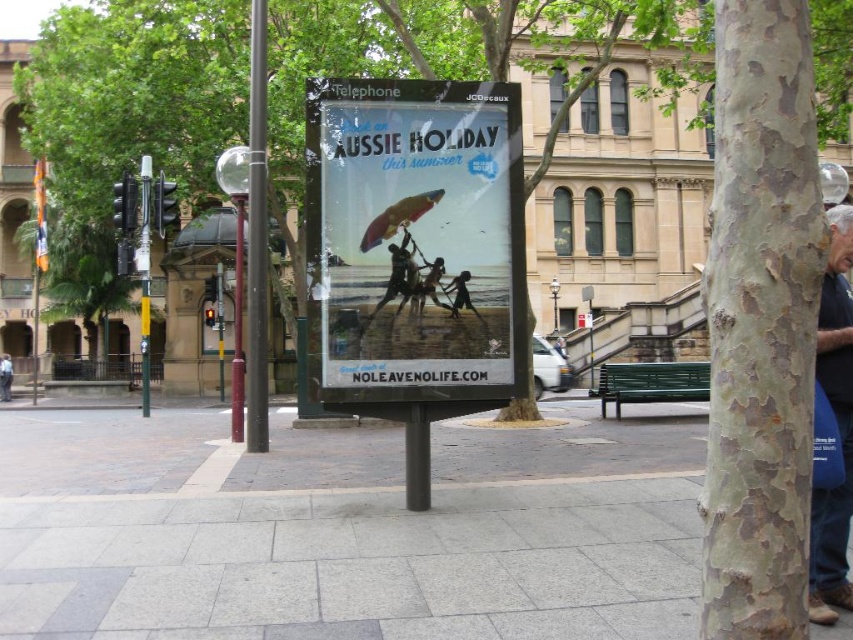
Question: Can you confirm if smooth bark tree at center is positioned above dark blue jeans at lower left?

Choices:
 (A) no
 (B) yes

Answer: (B)

Question: Is silhouette sand at center further to camera compared to dark blue jeans at lower left?

Choices:
 (A) no
 (B) yes

Answer: (A)

Question: Which object appears closest to the camera in this image?

Choices:
 (A) gray textured bark at right
 (B) matte black surfboard at center
 (C) matte plastic poster at center
 (D) smooth bark tree at center

Answer: (A)

Question: Can you confirm if smooth bark tree at center is positioned to the right of gray textured bark at right?

Choices:
 (A) no
 (B) yes

Answer: (A)

Question: Which point is closer to the camera taking this photo?

Choices:
 (A) (811, 557)
 (B) (68, 280)
 (C) (1, 365)
 (D) (469, 307)

Answer: (A)

Question: Which of these objects is positioned farthest from the matte black surfboard at center?

Choices:
 (A) silhouette sand at center
 (B) dark blue shirt at right
 (C) green leafy tree at left

Answer: (C)